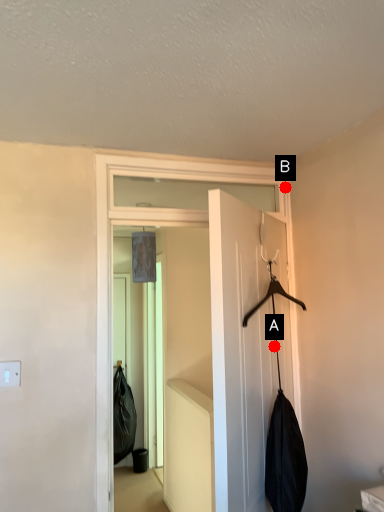
Question: Two points are circled on the image, labeled by A and B beside each circle. Which point is further to the camera?

Choices:
 (A) A is further
 (B) B is further

Answer: (B)